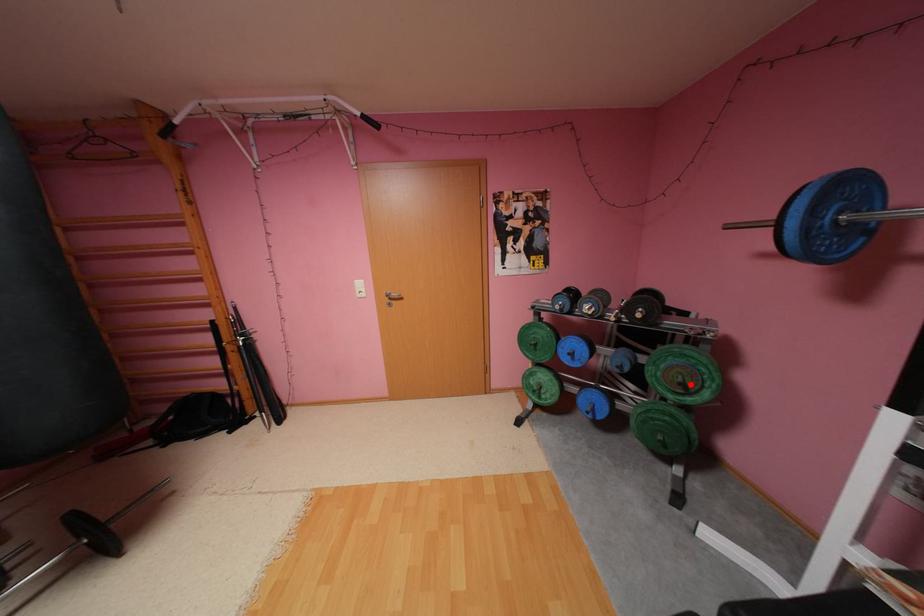
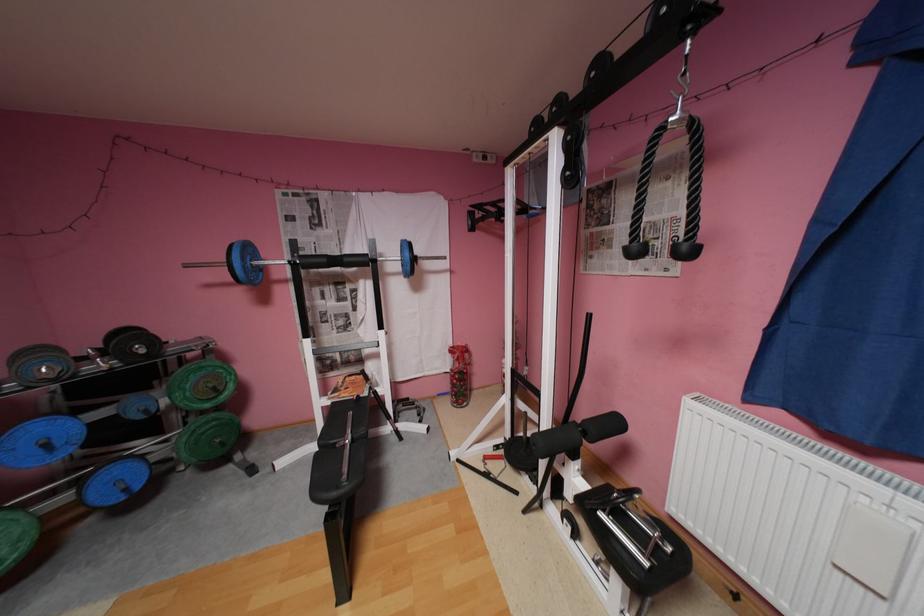
Locate, in the second image, the point that corresponds to the highlighted location in the first image.

(224, 387)